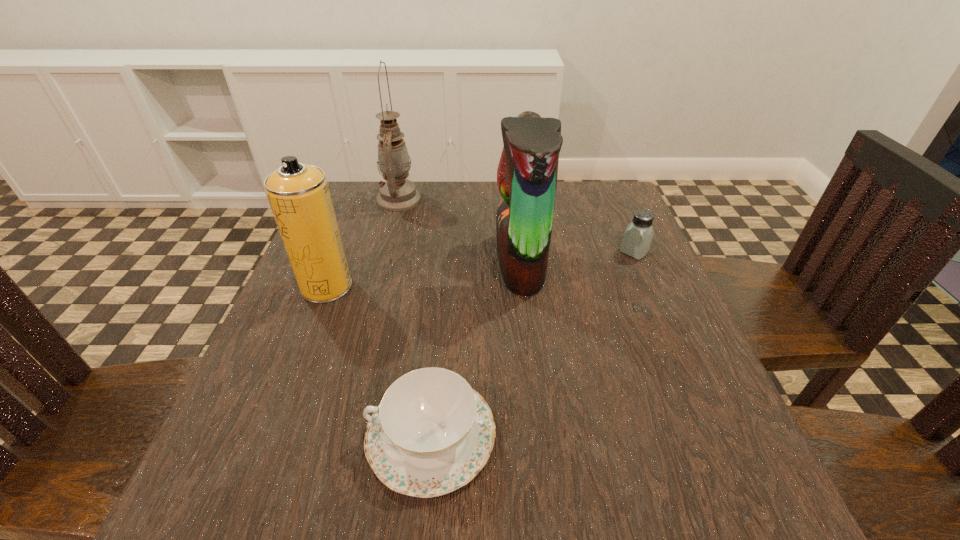
Where is `aerosol can positioned at the left edge`? aerosol can positioned at the left edge is located at coordinates (299, 196).

The image size is (960, 540). I want to click on object that is at the right edge, so click(x=637, y=238).

Locate an element on the screen. The width and height of the screenshot is (960, 540). object at the far left corner is located at coordinates (397, 193).

Find the location of a particular element. This screenshot has width=960, height=540. vacant area at the far edge of the desktop is located at coordinates (417, 188).

This screenshot has width=960, height=540. Find the location of `vacant point at the near edge`. vacant point at the near edge is located at coordinates (588, 498).

I want to click on vacant point at the left edge, so click(310, 375).

This screenshot has height=540, width=960. In the image, there is a desktop. In order to click on vacant space at the right edge in this screenshot , I will do `click(665, 360)`.

The width and height of the screenshot is (960, 540). In the image, there is a desktop. Find the location of `vacant space at the near left corner`. vacant space at the near left corner is located at coordinates (228, 476).

Where is `vacant space at the far right corner of the desktop`? Image resolution: width=960 pixels, height=540 pixels. vacant space at the far right corner of the desktop is located at coordinates (581, 201).

Locate an element on the screen. Image resolution: width=960 pixels, height=540 pixels. free region at the near right corner of the desktop is located at coordinates (706, 474).